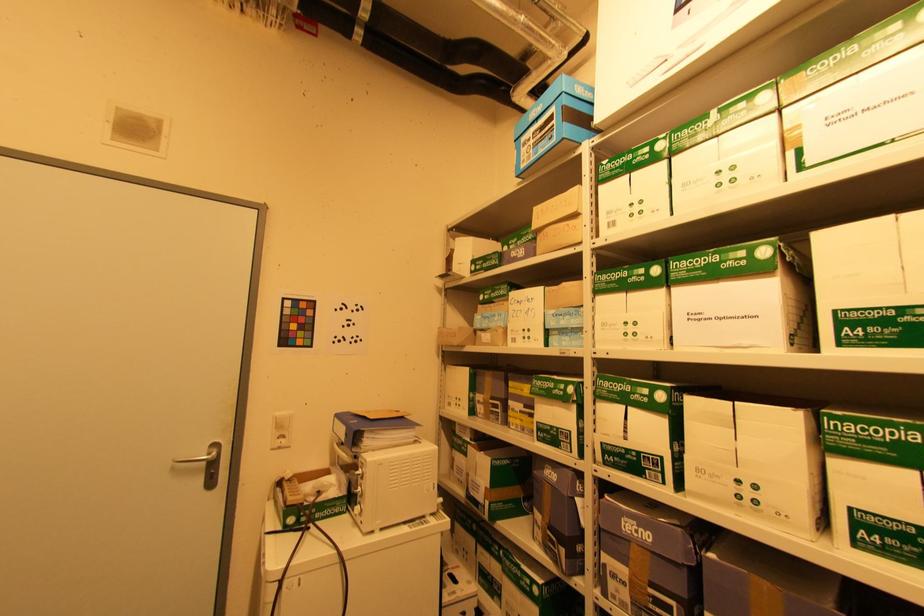
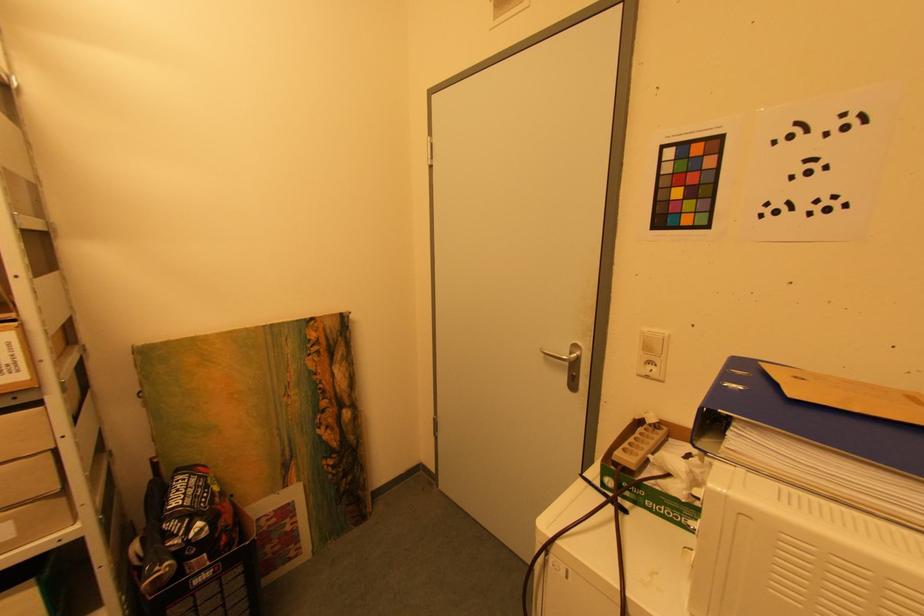
Question: The images are taken continuously from a first-person perspective. In which direction is your viewpoint rotating?

Choices:
 (A) Left
 (B) Right
 (C) Up
 (D) Down

Answer: (A)